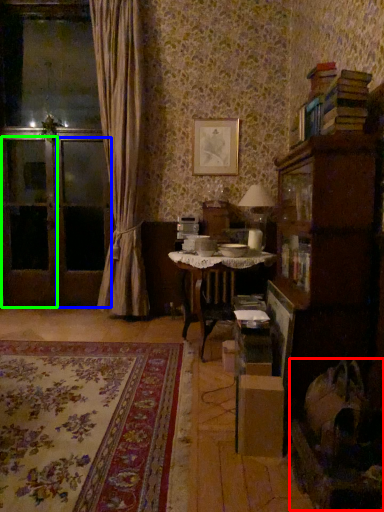
Question: Estimate the real-world distances between objects in this image. Which object is closer to swivel chair (highlighted by a red box), screen door (highlighted by a blue box) or screen door (highlighted by a green box)?

Choices:
 (A) screen door
 (B) screen door

Answer: (A)